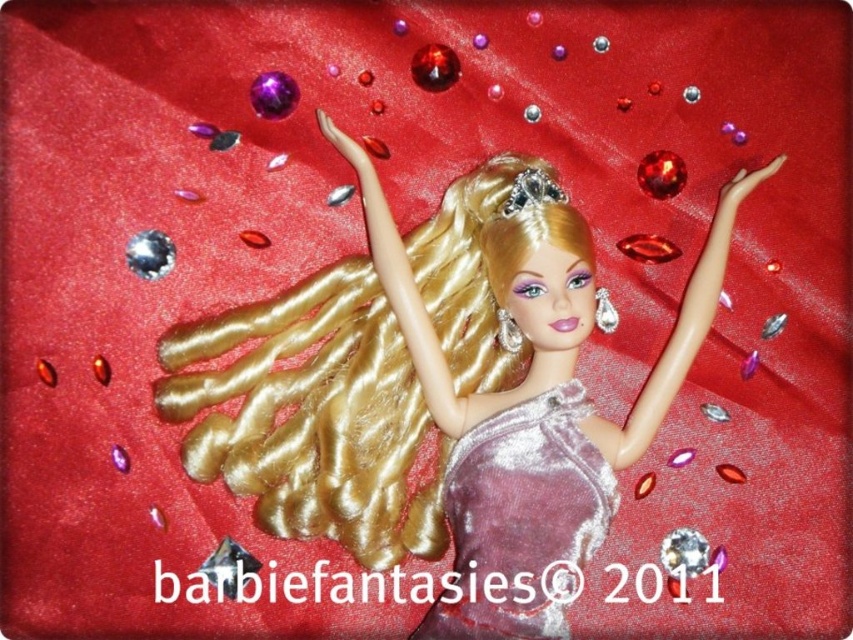
You are a photographer setting up a shoot with a Barbie doll against a red background. You notice the shiny gold hair at center and the satin purple dress at center. Which object is closer to the camera?

The shiny gold hair at center is closer to the camera because the satin purple dress at center is behind it.

You are a fashion designer who wants to create a new outfit for Barbie. You have a 5.5 inch wide fabric. Can you place both the shiny gold hair at center and the satin purple dress at center on the fabric without overlapping?

The shiny gold hair at center and satin purple dress at center are 6.08 inches apart, so no, the fabric is not wide enough to fit both items without overlapping since it is narrower than the required space between them.

Looking at the Barbie doll in the image, which object is located at the coordinates point (312, 417)?

The point (312, 417) indicates shiny gold hair at center.